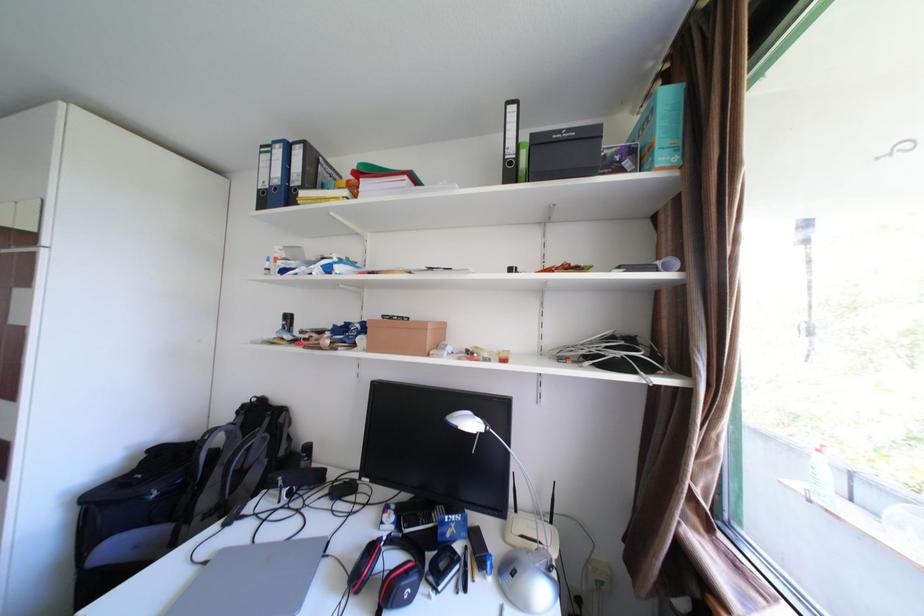
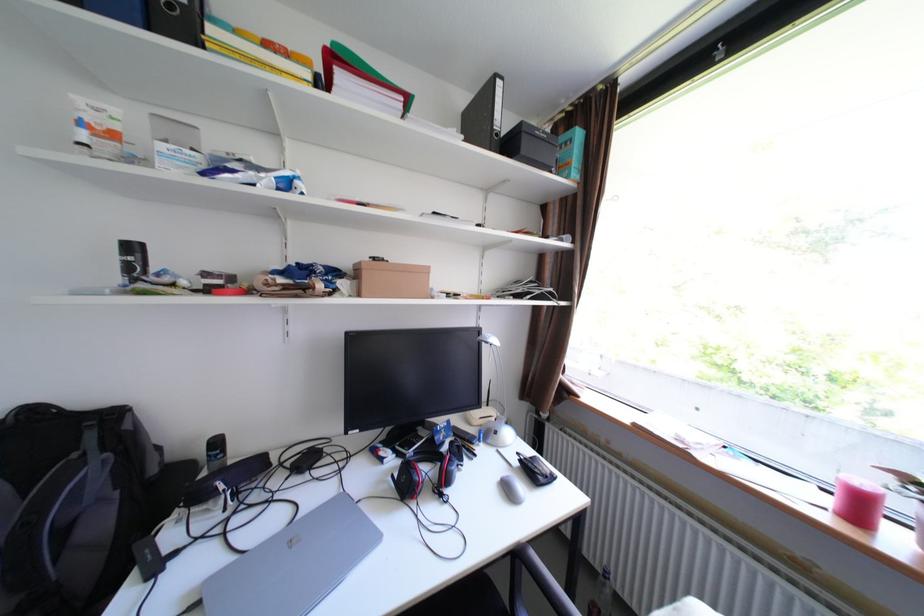
Find the pixel in the second image that matches (265,476) in the first image.

(110, 524)